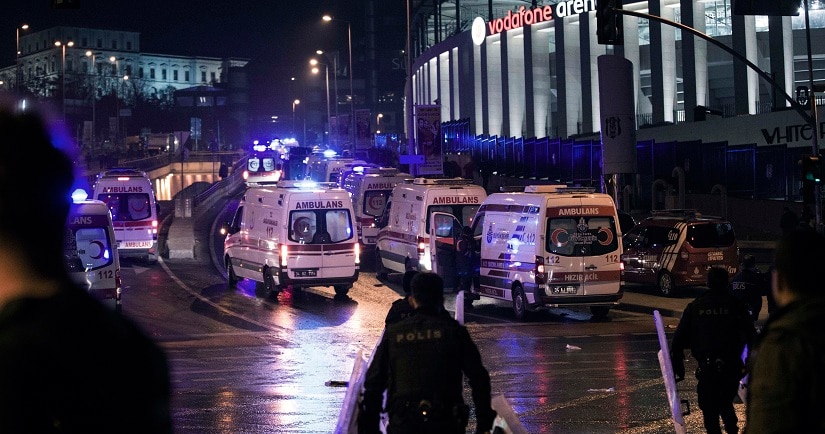
I want to click on lights, so click(285, 138).